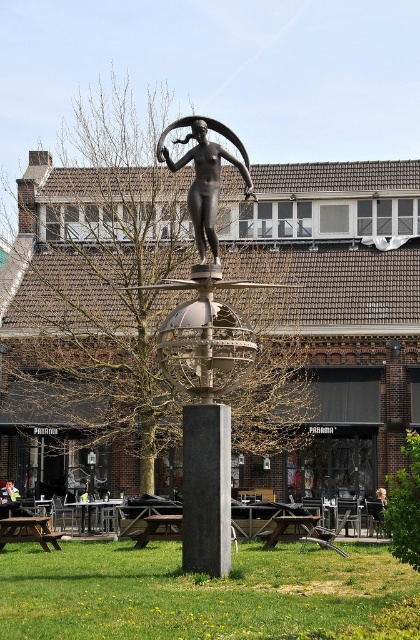
Question: Is polished bronze sculpture at center above smooth gray pole at center?

Choices:
 (A) yes
 (B) no

Answer: (A)

Question: Does brown leafless tree at center appear under polished bronze sculpture at center?

Choices:
 (A) yes
 (B) no

Answer: (B)

Question: Estimate the real-world distances between objects in this image. Which object is farther from the brown leafless tree at center?

Choices:
 (A) bronze statue at center
 (B) smooth gray pole at center

Answer: (B)

Question: Does polished bronze sculpture at center have a greater width compared to smooth gray pole at center?

Choices:
 (A) yes
 (B) no

Answer: (A)

Question: Which point appears closest to the camera in this image?

Choices:
 (A) (147, 227)
 (B) (196, 228)

Answer: (B)

Question: Which point appears closest to the camera in this image?

Choices:
 (A) (68, 339)
 (B) (209, 524)
 (C) (214, 509)

Answer: (B)